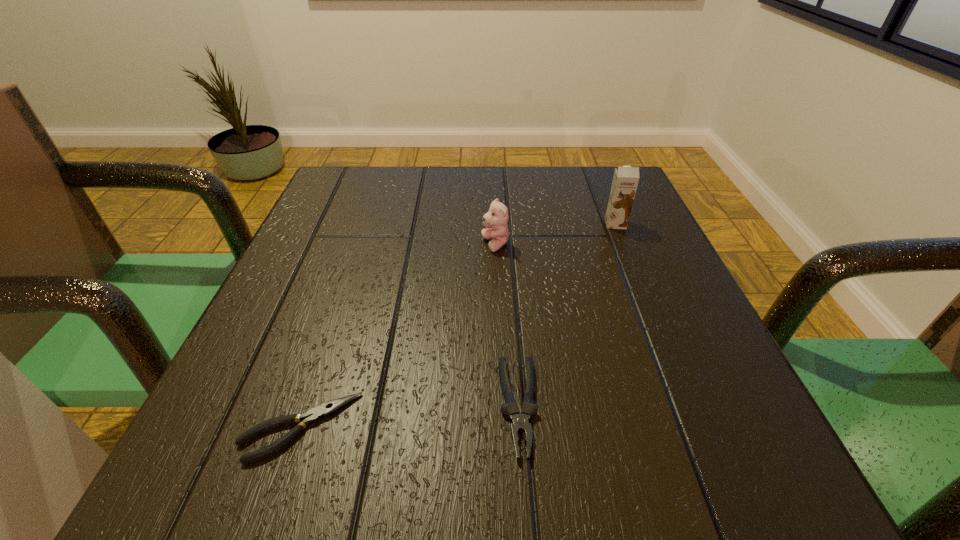
At what (x,y) coordinates should I click in order to perform the action: click on vacant region between the chocolate milk and the left pliers. Please return your answer as a coordinate pair (x, y). The image size is (960, 540). Looking at the image, I should click on (458, 325).

At what (x,y) coordinates should I click in order to perform the action: click on empty space that is in between the taller pliers and the shortest object. Please return your answer as a coordinate pair (x, y). This screenshot has width=960, height=540. Looking at the image, I should click on (410, 417).

This screenshot has width=960, height=540. I want to click on vacant space that is in between the shortest object and the teddy bear, so click(398, 336).

Where is `unoccupied position between the left pliers and the second shortest object`? The image size is (960, 540). unoccupied position between the left pliers and the second shortest object is located at coordinates (410, 417).

Where is `free spot between the third tallest object and the shorter pliers`? The height and width of the screenshot is (540, 960). free spot between the third tallest object and the shorter pliers is located at coordinates (410, 417).

Select which object appears as the closest to the taller pliers. Please provide its 2D coordinates. Your answer should be formatted as a tuple, i.e. [(x, y)], where the tuple contains the x and y coordinates of a point satisfying the conditions above.

[(314, 415)]

Choose which object is the nearest neighbor to the tallest object. Please provide its 2D coordinates. Your answer should be formatted as a tuple, i.e. [(x, y)], where the tuple contains the x and y coordinates of a point satisfying the conditions above.

[(497, 217)]

I want to click on free space that satisfies the following two spatial constraints: 1. at the face of the third nearest object; 2. on the front side of the left pliers, so click(x=503, y=427).

At what (x,y) coordinates should I click in order to perform the action: click on free location that satisfies the following two spatial constraints: 1. at the face of the second farthest object; 2. on the front side of the shorter pliers. Please return your answer as a coordinate pair (x, y). Image resolution: width=960 pixels, height=540 pixels. Looking at the image, I should click on (503, 427).

Identify the location of vacant space that satisfies the following two spatial constraints: 1. on the front side of the farthest object; 2. at the face of the second tallest object. The image size is (960, 540). (624, 245).